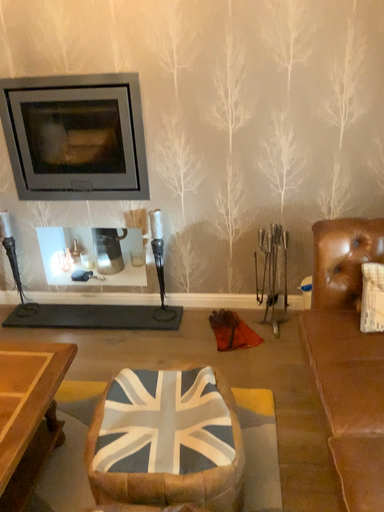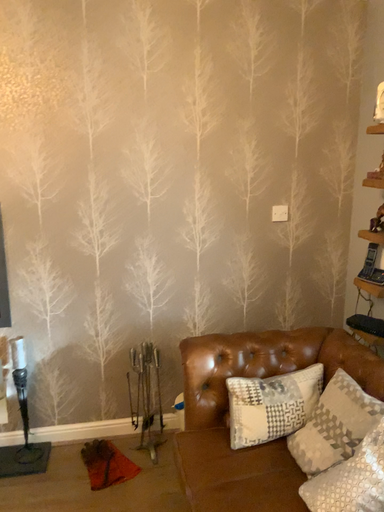
Question: How did the camera likely rotate when shooting the video?

Choices:
 (A) rotated upward
 (B) rotated downward

Answer: (A)